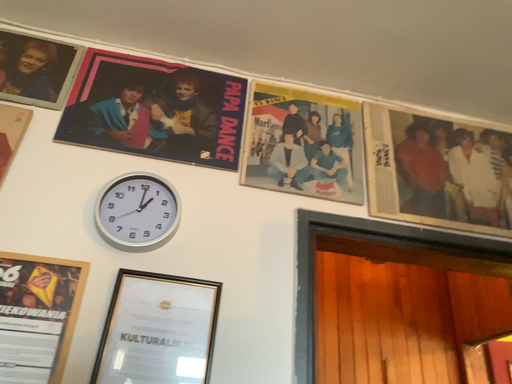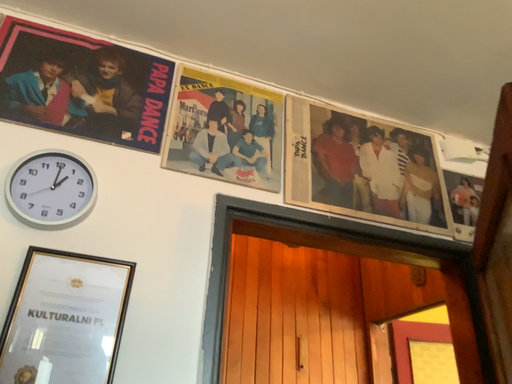
Question: How did the camera likely rotate when shooting the video?

Choices:
 (A) rotated left
 (B) rotated right

Answer: (B)